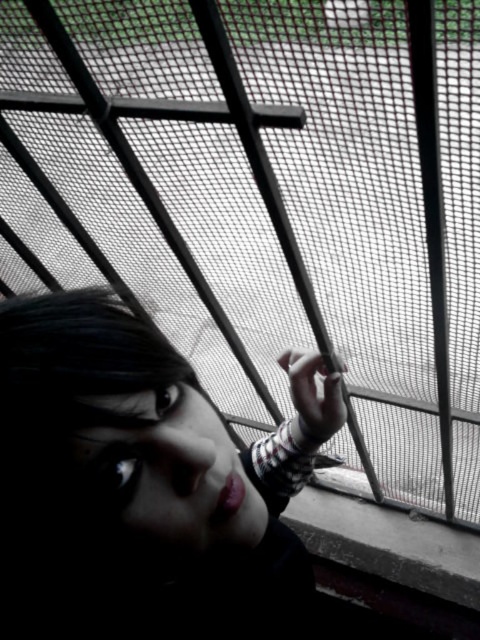
Question: Does matte black hair at center have a larger size compared to matte skin face at lower left?

Choices:
 (A) no
 (B) yes

Answer: (B)

Question: Is matte black hair at center below matte skin face at lower left?

Choices:
 (A) yes
 (B) no

Answer: (A)

Question: Which point appears farthest from the camera in this image?

Choices:
 (A) (147, 520)
 (B) (91, 401)

Answer: (A)

Question: Which object is farther from the camera taking this photo?

Choices:
 (A) matte black hair at center
 (B) matte skin face at lower left

Answer: (B)

Question: Does matte black hair at center appear on the left side of matte skin face at lower left?

Choices:
 (A) no
 (B) yes

Answer: (A)